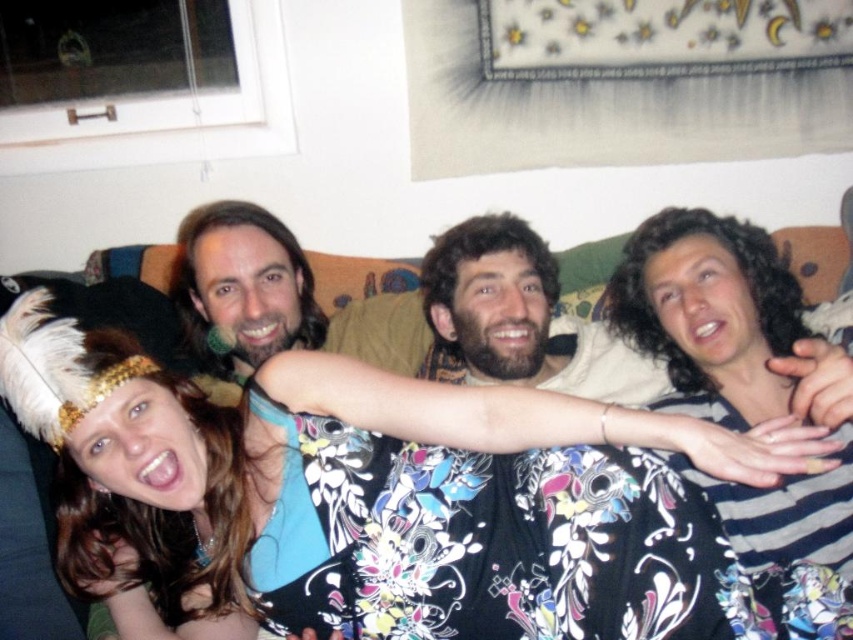
You are standing in front of the couch and want to touch the point at coordinates (x=717, y=314). Which person should you approach to reach that point?

The point at coordinates (x=717, y=314) is located on the striped cotton shirt at right, so you should approach the fourth person on the right wearing the striped shirt to reach that point.

You are standing in the room and want to find the floral dress at center. Which direction should you look to see the point at coordinates (386, 500)?

The point at coordinates (386, 500) is located on the floral dress at center, so you should look towards the center of the room to see it.

You are standing at the camera position and want to reach point (x=107, y=433). Can you walk directly to that point without moving any objects?

The distance between point (x=107, y=433) and the camera is 1.03 meters. Since there are no objects mentioned in the scene blocking the path, you can walk directly to that point without moving any objects.